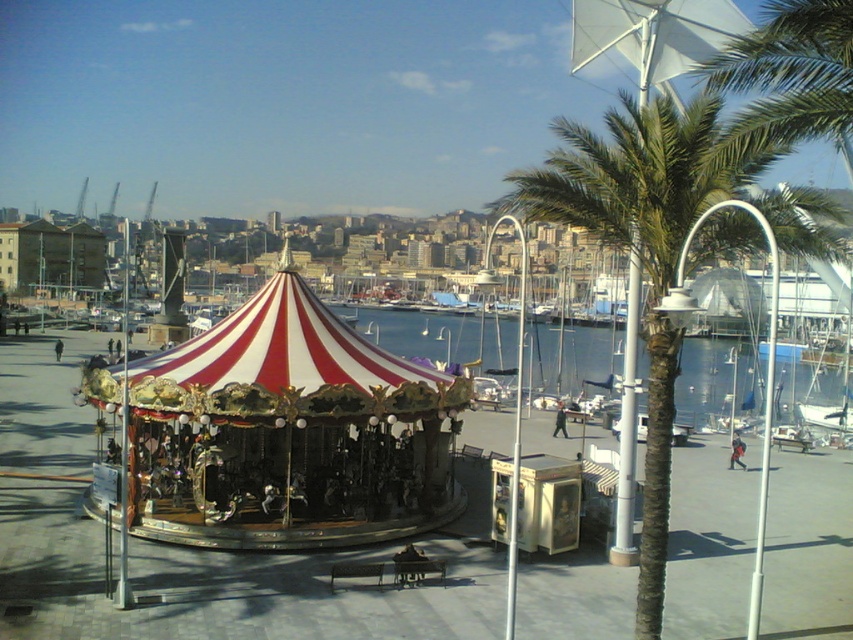
Which of these two, red and white striped canopy at center or white water at center, stands taller?

Standing taller between the two is white water at center.

Which is in front, point (285, 413) or point (364, 333)?

Point (285, 413)

Describe the element at coordinates (279, 368) in the screenshot. The width and height of the screenshot is (853, 640). I see `red and white striped canopy at center` at that location.

Where is `red and white striped canopy at center`? The height and width of the screenshot is (640, 853). red and white striped canopy at center is located at coordinates click(x=279, y=368).

How much distance is there between green leafy palm tree at center and red and white striped canopy at center?

The distance of green leafy palm tree at center from red and white striped canopy at center is 11.24 meters.

Is green leafy palm tree at center to the left of red and white striped canopy at center from the viewer's perspective?

No, green leafy palm tree at center is not to the left of red and white striped canopy at center.

Locate an element on the screen. The height and width of the screenshot is (640, 853). green leafy palm tree at center is located at coordinates [643, 250].

Is white water at center above metallic pole at center?

No, white water at center is not above metallic pole at center.

Which is in front, point (611, 410) or point (123, 337)?

Positioned in front is point (611, 410).

Does point (729, 346) lie behind point (125, 346)?

Yes, point (729, 346) is behind point (125, 346).

The height and width of the screenshot is (640, 853). In order to click on white water at center in this screenshot , I will do `click(440, 336)`.